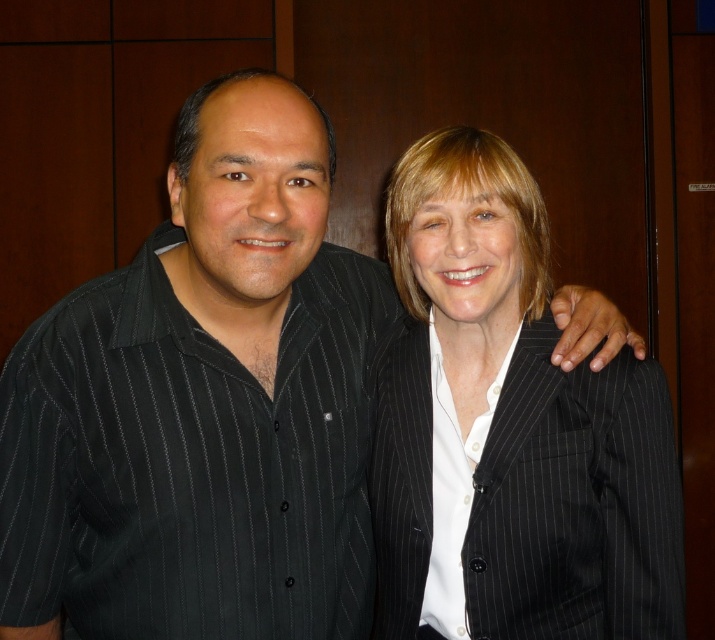
Does black pinstripe suit at right lie behind white smooth shirt at center?

No, black pinstripe suit at right is closer to the viewer.

Is point (644, 428) closer to viewer compared to point (433, 384)?

Yes, it is in front of point (433, 384).

The image size is (715, 640). I want to click on black pinstripe suit at right, so click(508, 429).